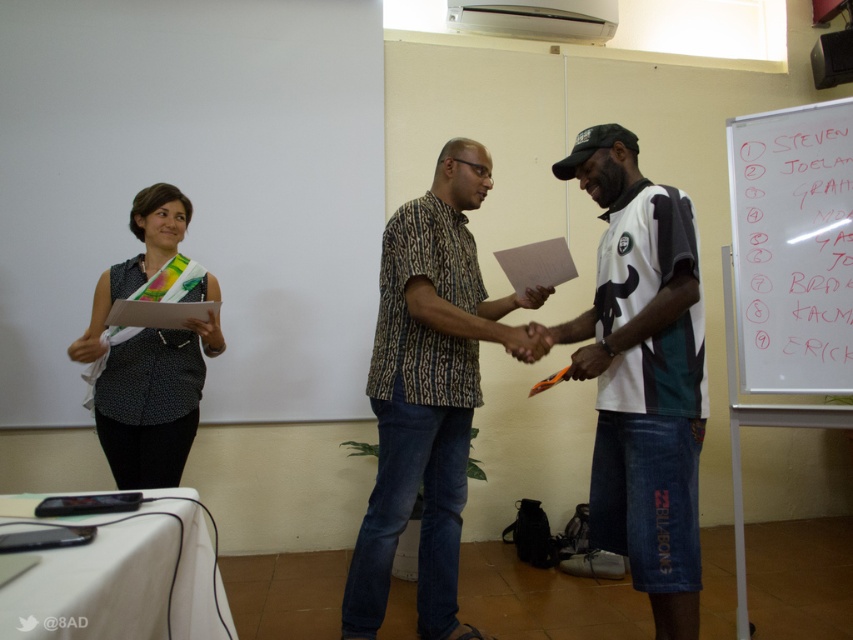
Question: Does patterned fabric shirt at center come behind black dotted shirt at left?

Choices:
 (A) yes
 (B) no

Answer: (B)

Question: Does whiteboard at upper right come in front of black dotted shirt at left?

Choices:
 (A) yes
 (B) no

Answer: (B)

Question: Is patterned fabric shirt at center above black dotted shirt at left?

Choices:
 (A) no
 (B) yes

Answer: (A)

Question: Which object is the farthest from the patterned fabric shirt at center?

Choices:
 (A) white jersey at center
 (B) whiteboard at upper right
 (C) black dotted shirt at left

Answer: (B)

Question: Among these objects, which one is nearest to the camera?

Choices:
 (A) patterned fabric shirt at center
 (B) white jersey at center

Answer: (B)

Question: Which point is farther to the camera?

Choices:
 (A) (456, 417)
 (B) (746, 189)
 (C) (685, 544)
 (D) (180, 420)

Answer: (B)